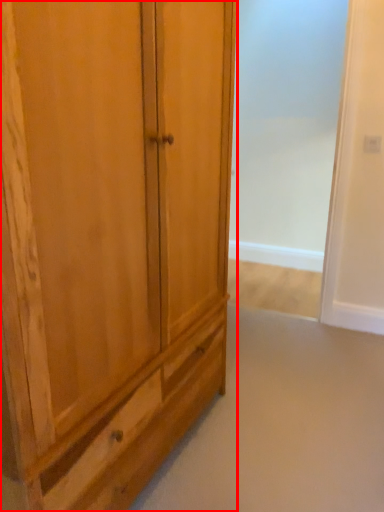
Question: In this image, where is cupboard (annotated by the red box) located relative to screen door?

Choices:
 (A) left
 (B) right

Answer: (A)